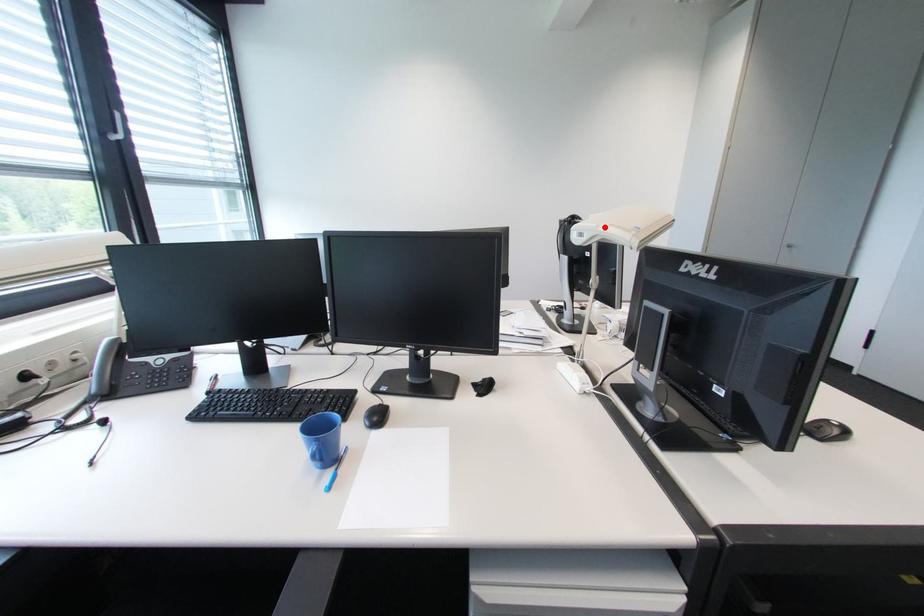
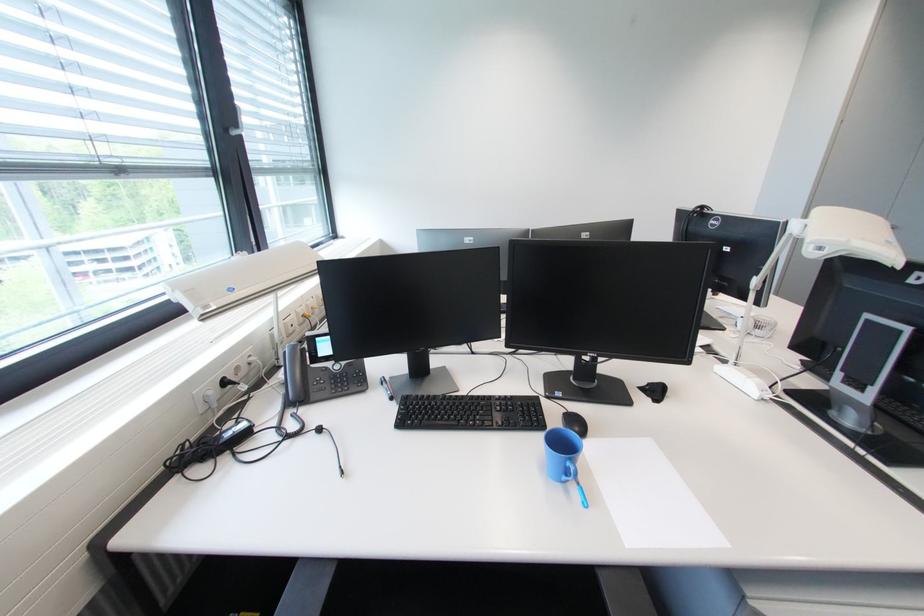
Locate, in the second image, the point that corresponds to the highlighted location in the first image.

(856, 243)